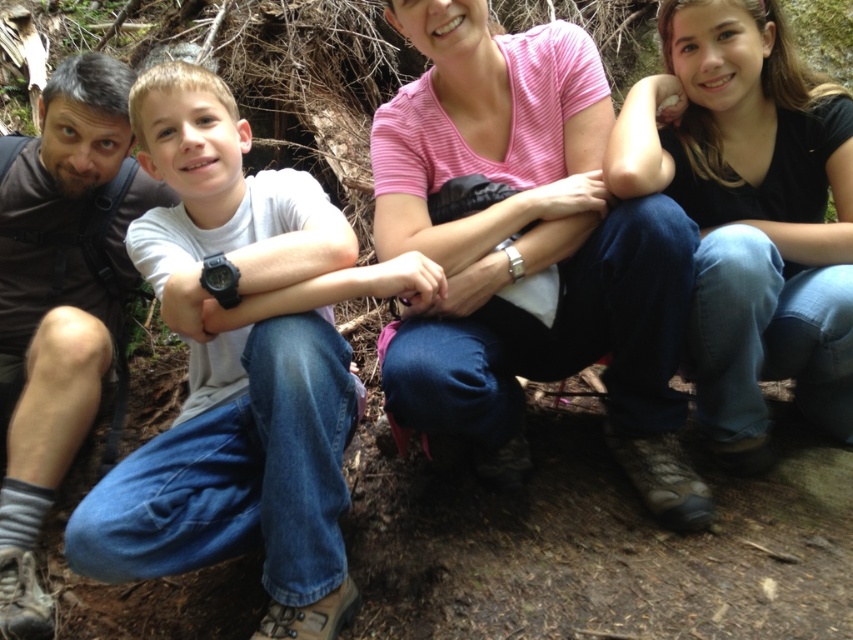
Question: Can you confirm if white matte shirt at center is smaller than pink striped shirt at center?

Choices:
 (A) no
 (B) yes

Answer: (A)

Question: Which is nearer to the pink striped shirt at center?

Choices:
 (A) blue jeans at lower right
 (B) white matte shirt at center

Answer: (A)

Question: Is pink striped shirt at center wider than blue jeans at lower right?

Choices:
 (A) yes
 (B) no

Answer: (A)

Question: Does pink striped shirt at center appear on the right side of blue jeans at lower right?

Choices:
 (A) yes
 (B) no

Answer: (B)

Question: Estimate the real-world distances between objects in this image. Which object is farther from the white matte shirt at center?

Choices:
 (A) blue jeans at lower right
 (B) pink striped shirt at center

Answer: (A)

Question: Estimate the real-world distances between objects in this image. Which object is farther from the pink striped shirt at center?

Choices:
 (A) white matte shirt at center
 (B) blue jeans at lower right

Answer: (A)